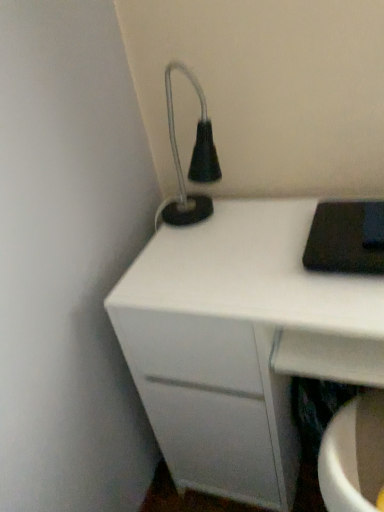
Find the location of a particular element. This screenshot has width=384, height=512. vacant space situated above white matte chest of drawers at center (from a real-world perspective) is located at coordinates (249, 248).